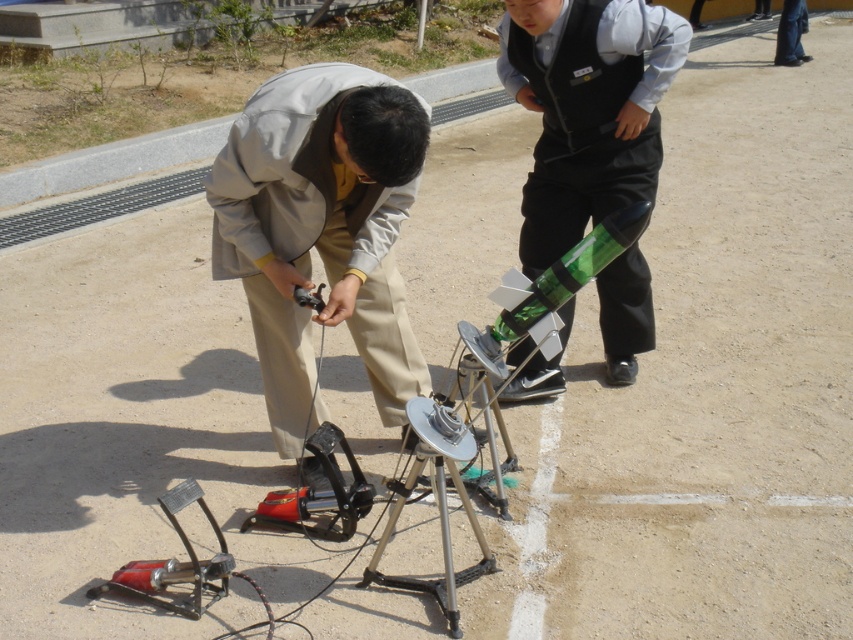
You are standing in the outdoor scene and want to place a new object between the two points labeled point (x=401, y=422) and point (x=505, y=38). Which point should the object be closer to in order to appear larger in the image?

The object should be placed closer to point (x=401, y=422) because it is closer to the viewer, so objects placed near it will appear larger in the image compared to those placed near point (x=505, y=38).

You are standing in the outdoor scene and want to pick up the matte gray jacket at center. Which direction should you move relative to the green plastic rocket at center?

The matte gray jacket at center is to the left of the green plastic rocket at center, so you should move to the left side of the green plastic rocket at center to pick it up.